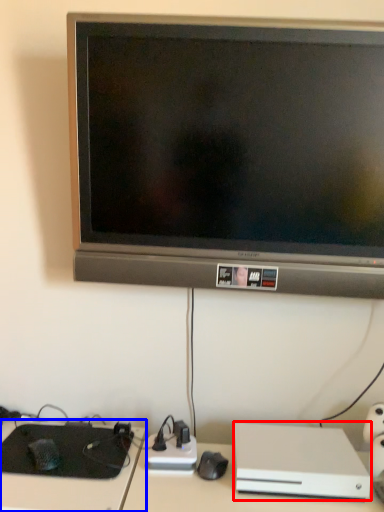
Question: Which of the following is the farthest to the observer, computer (highlighted by a red box) or computer desk (highlighted by a blue box)?

Choices:
 (A) computer
 (B) computer desk

Answer: (B)